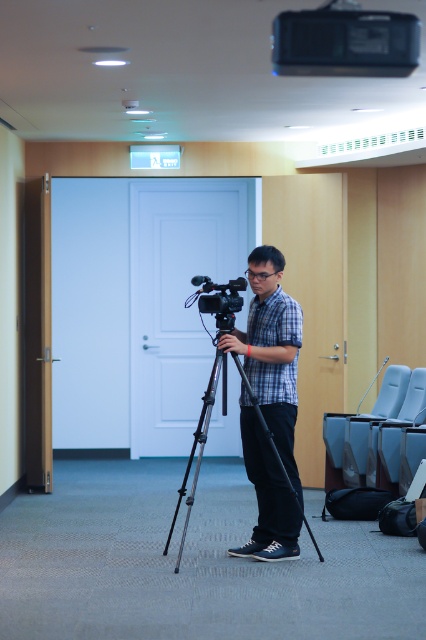
Question: Can you confirm if plaid shirt at center is positioned below black metal tripod at center?

Choices:
 (A) yes
 (B) no

Answer: (B)

Question: Which of the following is the farthest from the observer?

Choices:
 (A) (255, 381)
 (B) (331, 20)
 (C) (215, 296)

Answer: (A)

Question: Does black metal tripod at center appear over matte black camera at center?

Choices:
 (A) yes
 (B) no

Answer: (B)

Question: Is the position of black plastic projector at upper center more distant than that of matte black camera at center?

Choices:
 (A) yes
 (B) no

Answer: (B)

Question: Which object appears closest to the camera in this image?

Choices:
 (A) matte black camera at center
 (B) plaid shirt at center
 (C) black metal tripod at center

Answer: (C)

Question: Which object appears farthest from the camera in this image?

Choices:
 (A) black plastic projector at upper center
 (B) black metal tripod at center

Answer: (B)